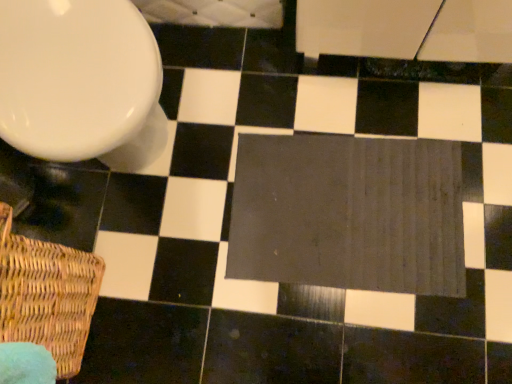
At what (x,y) coordinates should I click in order to perform the action: click on free space to the right of white glossy toilet at upper left. Please return your answer as a coordinate pair (x, y). Looking at the image, I should click on (240, 77).